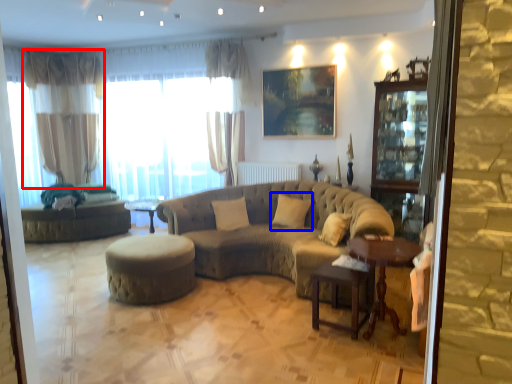
Question: Which object is closer to the camera taking this photo, curtain (highlighted by a red box) or pillow (highlighted by a blue box)?

Choices:
 (A) curtain
 (B) pillow

Answer: (B)